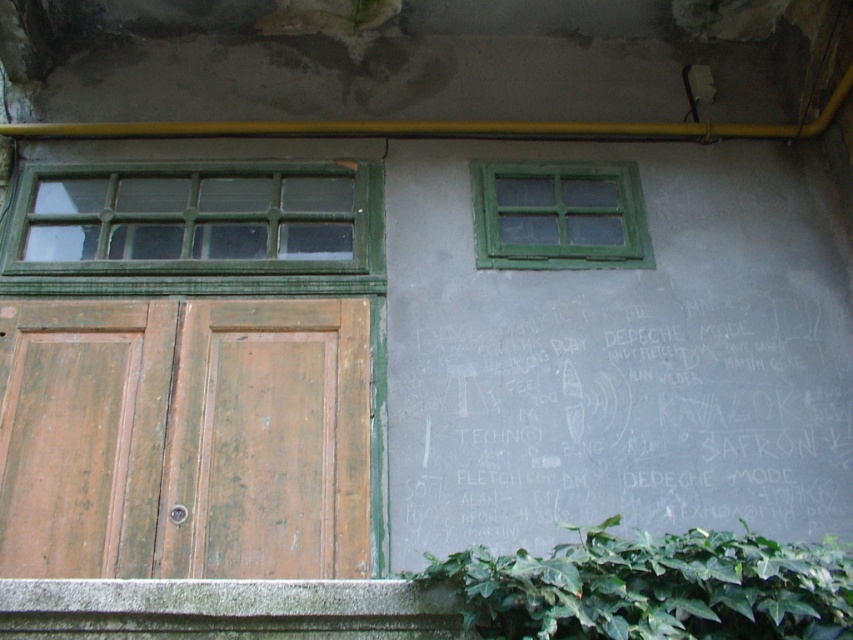
You are a painter hired to assess the exterior of this old building. You notice the black chalkboard at right and the green painted wood window at upper right. Which object requires more paint if they both need to be repainted, considering their size?

The black chalkboard at right requires more paint than the green painted wood window at upper right because it is larger in size.

You are an architect inspecting the old building. You notice two windows on the exterior wall. The first is the green wooden window at left, and the second is the green painted wood window at upper right. Which of these two windows is taller?

The green wooden window at left is much taller than the green painted wood window at upper right.